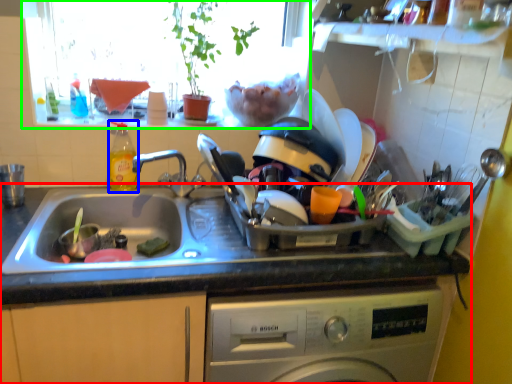
Question: Based on their relative distances, which object is nearer to countertop (highlighted by a red box)? Choose from bottle (highlighted by a blue box) and window screen (highlighted by a green box).

Choices:
 (A) bottle
 (B) window screen

Answer: (A)